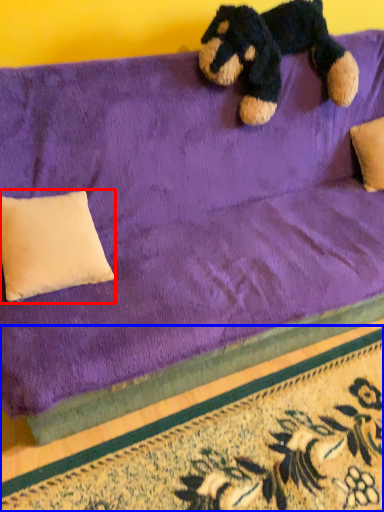
Question: Which object is closer to the camera taking this photo, pillow (highlighted by a red box) or doormat (highlighted by a blue box)?

Choices:
 (A) pillow
 (B) doormat

Answer: (B)